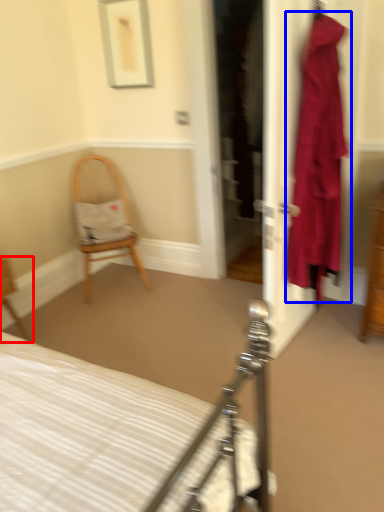
Question: Which object is further to the camera taking this photo, chair (highlighted by a red box) or clothing (highlighted by a blue box)?

Choices:
 (A) chair
 (B) clothing

Answer: (A)